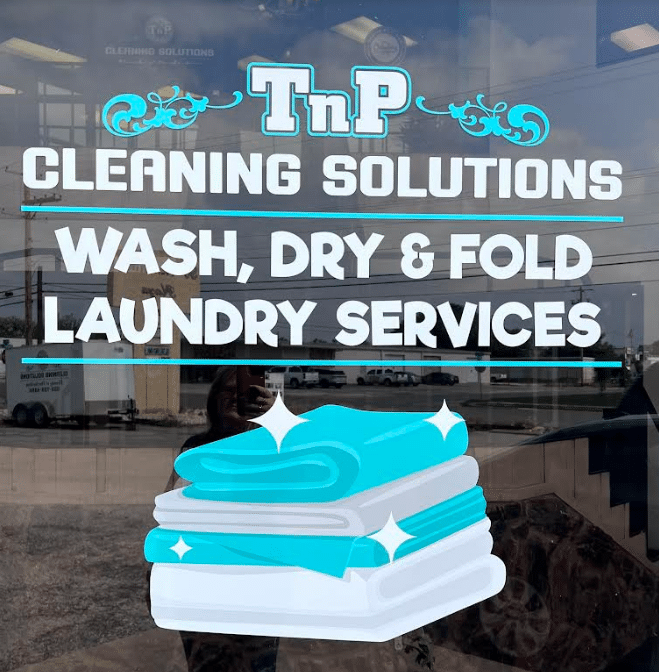
At what (x,y) coordinates should I click in order to perform the action: click on laundry. Please return your answer as a coordinate pair (x, y). Looking at the image, I should click on (310, 587), (306, 548), (326, 531), (335, 478).